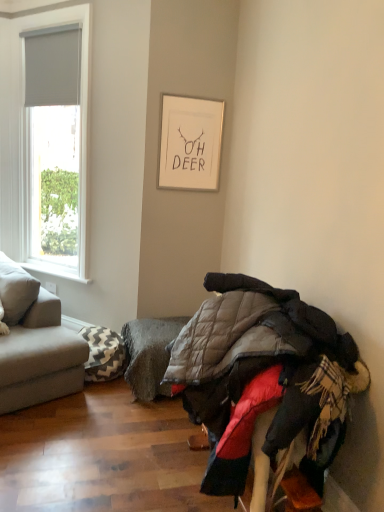
This screenshot has height=512, width=384. What do you see at coordinates (149, 354) in the screenshot?
I see `gray textured footrest at lower center` at bounding box center [149, 354].

The width and height of the screenshot is (384, 512). Describe the element at coordinates (54, 271) in the screenshot. I see `white painted wood at left` at that location.

Consider the image. What is the approximate width of quilted fabric jackets at lower right?

20.13 inches.

This screenshot has height=512, width=384. Describe the element at coordinates (103, 354) in the screenshot. I see `chevron-patterned fabric pillow at lower left` at that location.

Where is `gray fabric blind at upper left`? The image size is (384, 512). gray fabric blind at upper left is located at coordinates (53, 68).

You are a GUI agent. You are given a task and a screenshot of the screen. Output one action in this format:
    pyautogui.click(x=<x>, y=<y>)
    Task: Click on the gray textured footrest at lower center
    The width and height of the screenshot is (384, 512).
    Given the screenshot: What is the action you would take?
    pyautogui.click(x=149, y=354)

Is white matte picture frame at upper center far from quilted fabric jackets at lower right?

Yes.

From the image's perspective, which object appears higher, white matte picture frame at upper center or quilted fabric jackets at lower right?

white matte picture frame at upper center, from the image's perspective.

Between white matte picture frame at upper center and quilted fabric jackets at lower right, which one has smaller size?

white matte picture frame at upper center.

Which point is more distant from viewer, (152,350) or (68,277)?

The point (68,277) is behind.

From the image's perspective, is gray textured footrest at lower center located above or below white painted wood at left?

Clearly, from the image's perspective, gray textured footrest at lower center is below white painted wood at left.

From the picture: Does gray textured footrest at lower center appear on the left side of white painted wood at left?

No.

Which object is wider, gray textured footrest at lower center or white painted wood at left?

gray textured footrest at lower center is wider.

Based on the photo, which is correct: gray fabric couch at left is inside white matte window at left, or outside of it?

gray fabric couch at left lies outside white matte window at left.

Who is shorter, gray fabric couch at left or white matte window at left?

With less height is gray fabric couch at left.

In the scene shown: Is gray fabric couch at left not close to white matte window at left?

gray fabric couch at left is far away from white matte window at left.

Which is farther from the camera, (58, 342) or (24, 25)?

Point (24, 25)

Can you confirm if gray fabric couch at left is shorter than quilted fabric jackets at lower right?

No.

Is gray fabric couch at left not inside quilted fabric jackets at lower right?

Yes, gray fabric couch at left is located beyond the bounds of quilted fabric jackets at lower right.

Considering the positions of objects gray fabric couch at left and quilted fabric jackets at lower right in the image provided, who is behind, gray fabric couch at left or quilted fabric jackets at lower right?

gray fabric couch at left is behind.

Would you say white matte picture frame at upper center contains chevron-patterned fabric pillow at lower left?

No, chevron-patterned fabric pillow at lower left is not surrounded by white matte picture frame at upper center.

Is white matte picture frame at upper center oriented away from chevron-patterned fabric pillow at lower left?

No.

From a real-world perspective, is white matte picture frame at upper center positioned under chevron-patterned fabric pillow at lower left based on gravity?

No, from a real-world perspective, white matte picture frame at upper center is not under chevron-patterned fabric pillow at lower left.

Who is shorter, white matte picture frame at upper center or chevron-patterned fabric pillow at lower left?

With less height is chevron-patterned fabric pillow at lower left.

Can you tell me how much white matte window at left and white painted wood at left differ in facing direction?

white matte window at left and white painted wood at left are facing 0.164 degrees away from each other.

Considering the relative sizes of white matte window at left and white painted wood at left in the image provided, is white matte window at left thinner than white painted wood at left?

Incorrect, the width of white matte window at left is not less than that of white painted wood at left.

Is white matte window at left far away from white painted wood at left?

white matte window at left is actually quite close to white painted wood at left.

Is white matte window at left completely or partially outside of white painted wood at left?

Yes, white matte window at left is located beyond the bounds of white painted wood at left.

Between gray fabric blind at upper left and gray fabric couch at left, which one appears on the right side from the viewer's perspective?

Positioned to the right is gray fabric blind at upper left.

Choose the correct answer: Is gray fabric blind at upper left inside gray fabric couch at left or outside it?

The correct answer is: outside.

Between gray fabric blind at upper left and gray fabric couch at left, which one has smaller size?

gray fabric blind at upper left.

From a real-world perspective, relative to gray fabric couch at left, is gray fabric blind at upper left vertically above or below?

gray fabric blind at upper left is above gray fabric couch at left.

Identify the location of laundry below the white matte picture frame at upper center (from the image's perspective). The height and width of the screenshot is (512, 384). (264, 377).

Where is `footrest in front of the white painted wood at left`? footrest in front of the white painted wood at left is located at coordinates (149, 354).

Estimate the real-world distances between objects in this image. Which object is closer to gray fabric blind at upper left, gray fabric couch at left or white matte picture frame at upper center?

The object closer to gray fabric blind at upper left is white matte picture frame at upper center.

Based on their spatial positions, is white matte window at left or quilted fabric jackets at lower right closer to gray fabric blind at upper left?

The object closer to gray fabric blind at upper left is white matte window at left.

When comparing their distances from white matte window at left, does white matte picture frame at upper center or white painted wood at left seem closer?

white matte picture frame at upper center is positioned closer to the anchor white matte window at left.

Looking at this image, estimate the real-world distances between objects in this image. Which object is further from white matte window at left, gray fabric blind at upper left or gray fabric couch at left?

Among the two, gray fabric couch at left is located further to white matte window at left.

Which object lies further to the anchor point white matte window at left, chevron-patterned fabric pillow at lower left or white painted wood at left?

Based on the image, chevron-patterned fabric pillow at lower left appears to be further to white matte window at left.

Looking at the image, which one is located further to white painted wood at left, gray textured footrest at lower center or chevron-patterned fabric pillow at lower left?

gray textured footrest at lower center is positioned further to the anchor white painted wood at left.

From the image, which object appears to be farther from gray textured footrest at lower center, gray fabric blind at upper left or white matte picture frame at upper center?

gray fabric blind at upper left lies further to gray textured footrest at lower center than the other object.

Which object lies nearer to the anchor point gray fabric blind at upper left, white painted wood at left or white matte window at left?

white matte window at left is closer to gray fabric blind at upper left.

Identify the location of window between gray fabric blind at upper left and chevron-patterned fabric pillow at lower left from top to bottom. This screenshot has width=384, height=512. (80, 113).

I want to click on picture frame that lies between gray fabric blind at upper left and gray textured footrest at lower center from top to bottom, so click(x=190, y=143).

Where is `picture frame between gray fabric blind at upper left and quilted fabric jackets at lower right in the vertical direction`? The width and height of the screenshot is (384, 512). picture frame between gray fabric blind at upper left and quilted fabric jackets at lower right in the vertical direction is located at coordinates (190, 143).

At what (x,y) coordinates should I click in order to perform the action: click on window sill located between gray fabric couch at left and white matte picture frame at upper center in the left-right direction. Please return your answer as a coordinate pair (x, y). The image size is (384, 512). Looking at the image, I should click on (54, 271).